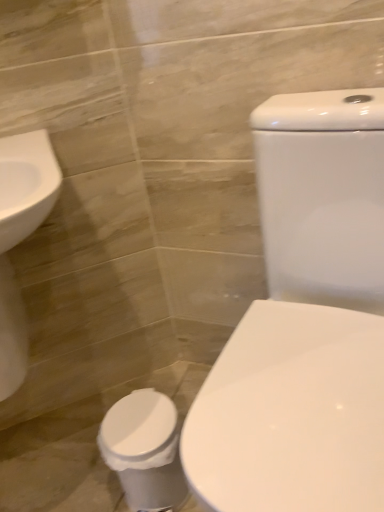
This screenshot has height=512, width=384. Find the location of `empty space that is ontop of white glossy toilet bowl at lower left`. empty space that is ontop of white glossy toilet bowl at lower left is located at coordinates pyautogui.click(x=136, y=420).